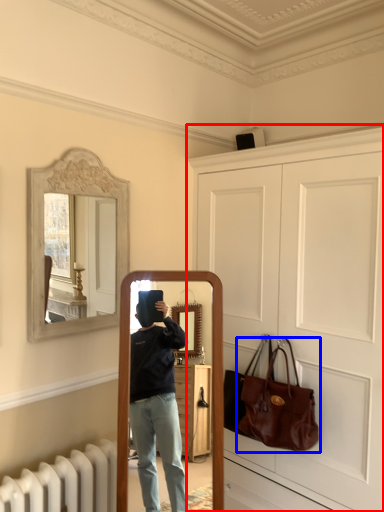
Question: Which object appears farthest to the camera in this image, door (highlighted by a red box) or handbag (highlighted by a blue box)?

Choices:
 (A) door
 (B) handbag

Answer: (B)